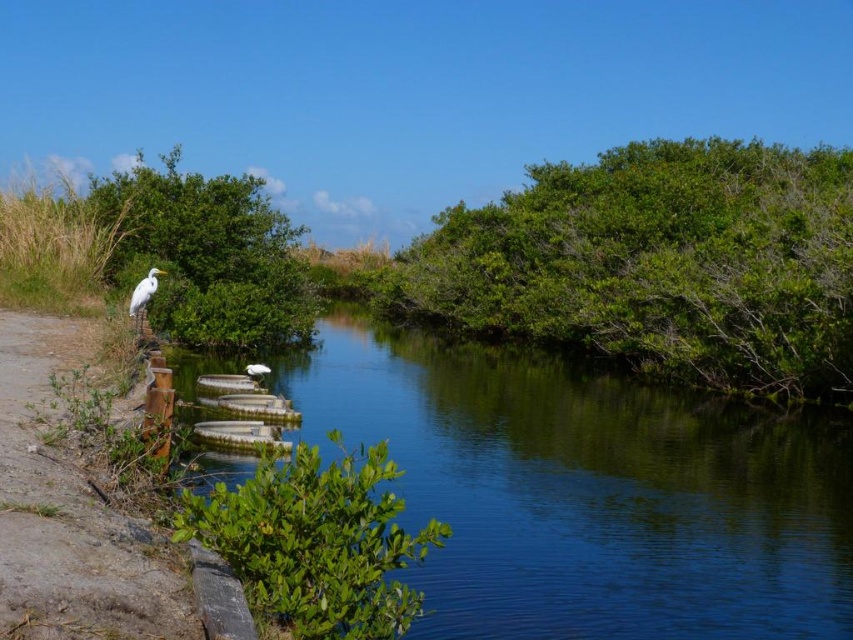
Who is shorter, clear blue water at center or green leafy bush at upper left?

With less height is clear blue water at center.

Is clear blue water at center shorter than green leafy bush at upper left?

Correct, clear blue water at center is not as tall as green leafy bush at upper left.

Find the location of a particular element. clear blue water at center is located at coordinates (587, 492).

Can you confirm if clear blue water at center is positioned above green leafy bush at lower left?

No, clear blue water at center is not above green leafy bush at lower left.

The image size is (853, 640). I want to click on clear blue water at center, so click(x=587, y=492).

Does point (193, 506) come in front of point (177, 236)?

That is True.

How much distance is there between green leafy bush at lower left and green leafy bush at upper left?

They are 22.86 meters apart.

Find the location of a particular element. green leafy bush at lower left is located at coordinates (315, 541).

Locate an element on the screen. This screenshot has width=853, height=640. green leafy bush at lower left is located at coordinates (315, 541).